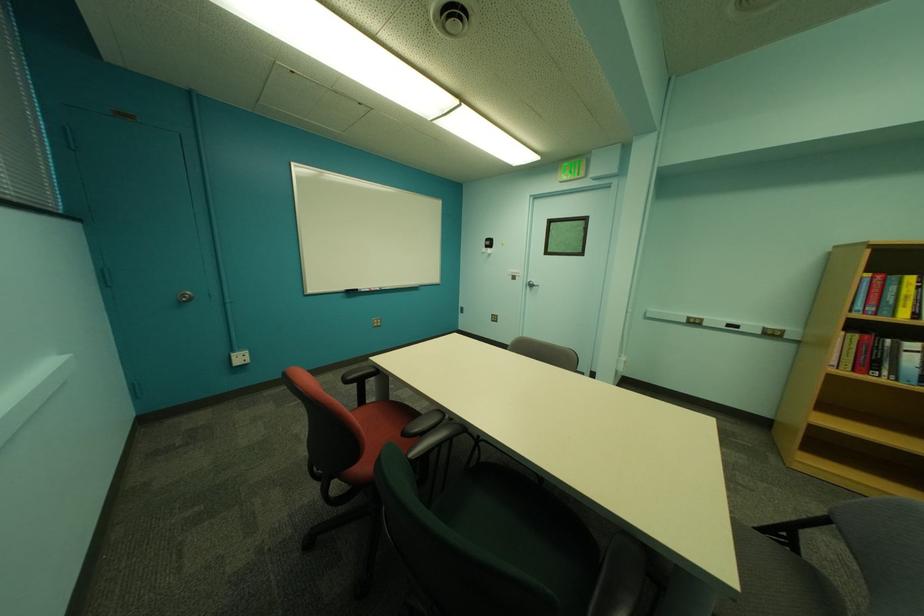
Where would you sit the green chair sitting surface? Please return your answer as a coordinate pair (x, y).

(784, 570)